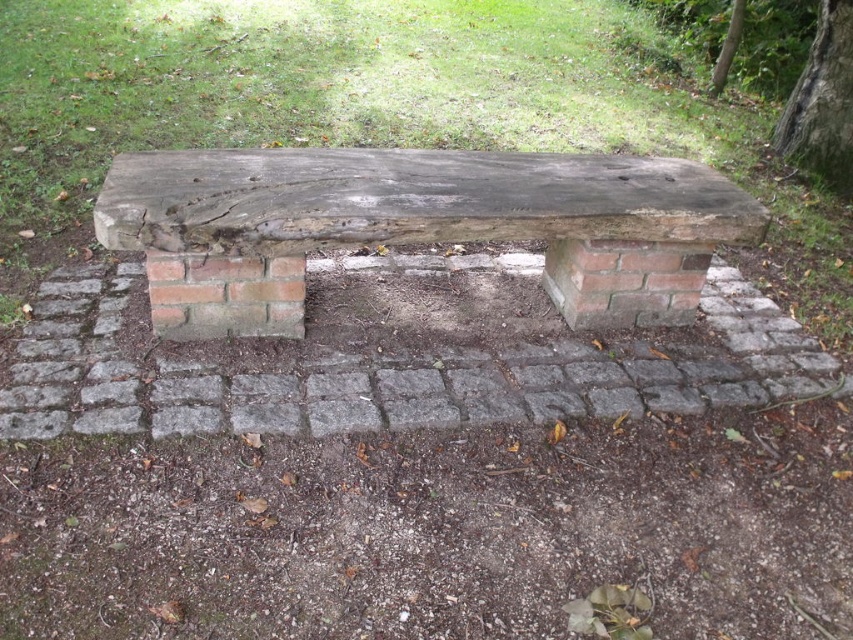
Question: Is weathered wood bench at center smaller than green rough bark at upper right?

Choices:
 (A) yes
 (B) no

Answer: (B)

Question: Where is weathered wood bench at center located in relation to green rough bark at upper right in the image?

Choices:
 (A) below
 (B) above

Answer: (A)

Question: Among these objects, which one is farthest from the camera?

Choices:
 (A) weathered wood bench at center
 (B) green rough bark at upper right

Answer: (B)

Question: Can you confirm if weathered wood bench at center is smaller than green leafy tree at upper right?

Choices:
 (A) no
 (B) yes

Answer: (A)

Question: Among these points, which one is nearest to the camera?

Choices:
 (A) (824, 20)
 (B) (740, 17)

Answer: (A)

Question: Which object is farther from the camera taking this photo?

Choices:
 (A) green rough bark at upper right
 (B) weathered wood bench at center

Answer: (A)